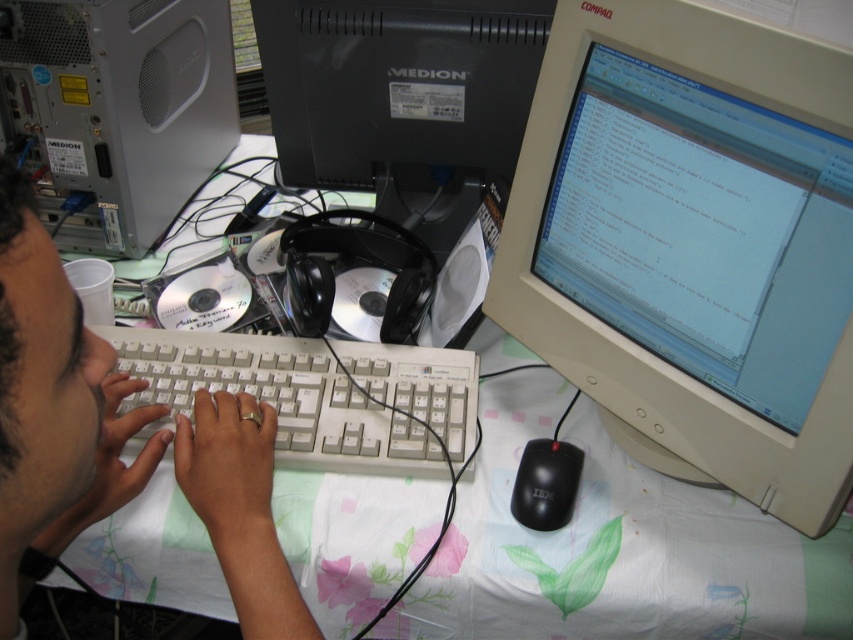
Question: Among these objects, which one is farthest from the camera?

Choices:
 (A) beige plastic monitor at center
 (B) white plastic keyboard at center
 (C) white plastic computer tower at upper left
 (D) black plastic mouse at lower right

Answer: (C)

Question: Does white plastic keyboard at center come in front of black plastic mouse at lower right?

Choices:
 (A) no
 (B) yes

Answer: (A)

Question: Which point appears closest to the camera in this image?

Choices:
 (A) (276, 625)
 (B) (352, 365)
 (C) (581, 54)

Answer: (A)

Question: Which point appears closest to the camera in this image?

Choices:
 (A) (64, 426)
 (B) (537, 509)
 (C) (10, 65)
 (D) (351, 461)

Answer: (A)

Question: Can you confirm if beige plastic monitor at center is positioned to the left of light skin hands at center?

Choices:
 (A) yes
 (B) no

Answer: (B)

Question: Does beige plastic monitor at center appear over black plastic monitor at upper center?

Choices:
 (A) yes
 (B) no

Answer: (B)